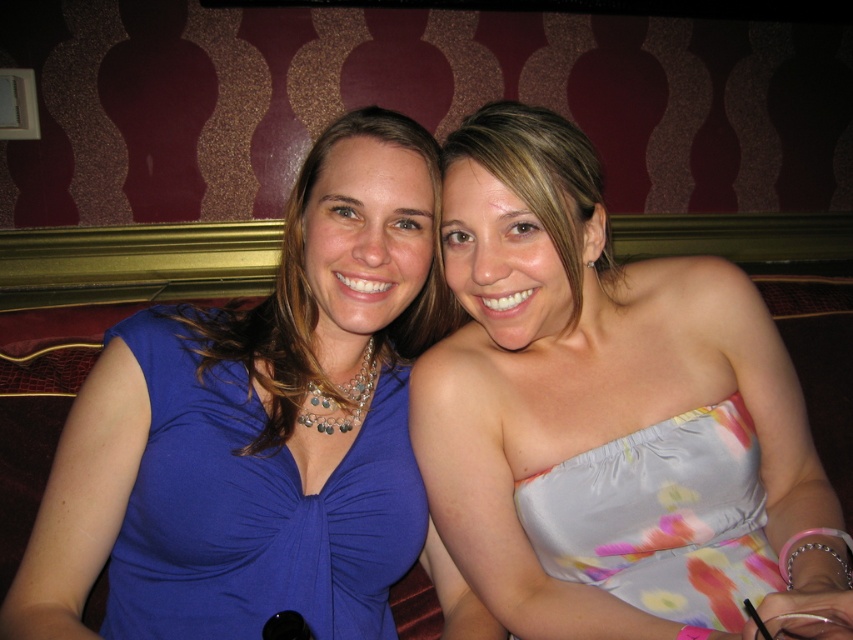
Question: Based on their relative distances, which object is nearer to the matte gray dress at center?

Choices:
 (A) matte blue dress at center
 (B) blue satin dress at center
 (C) floral satin dress at center

Answer: (A)

Question: Which point is farther to the camera?

Choices:
 (A) matte blue dress at center
 (B) matte blue dress at left
 (C) blue satin dress at center
 (D) floral satin dress at center

Answer: (A)

Question: Can you confirm if silky floral dress at center is positioned to the right of matte blue dress at center?

Choices:
 (A) no
 (B) yes

Answer: (B)

Question: Which point is farther to the camera?

Choices:
 (A) blue satin dress at center
 (B) matte blue dress at left
 (C) matte blue dress at center
 (D) silky floral dress at center

Answer: (C)

Question: Does matte blue dress at center appear under matte gray dress at center?

Choices:
 (A) yes
 (B) no

Answer: (A)

Question: Is silky floral dress at center wider than blue satin dress at center?

Choices:
 (A) yes
 (B) no

Answer: (A)